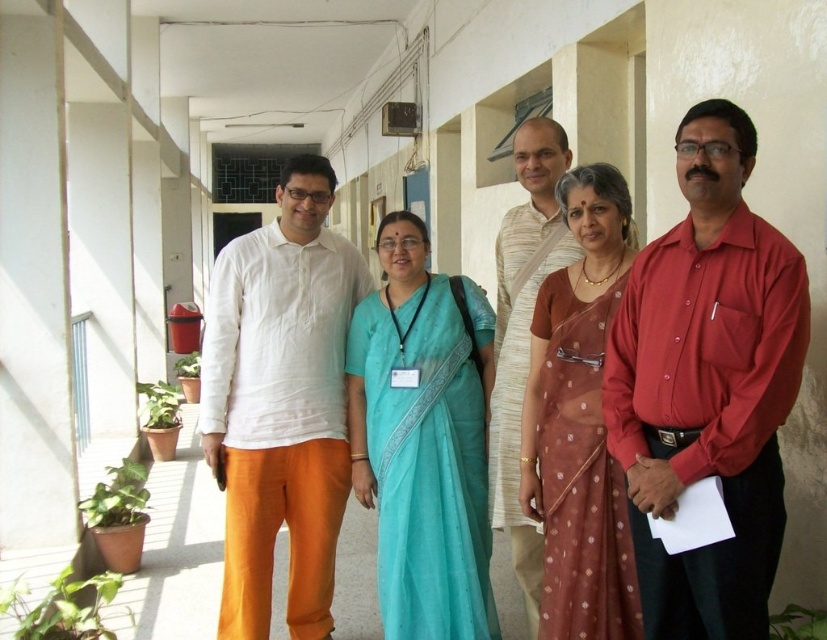
You are standing in the corridor and want to approach the woman in the teal saree with a black blouse and lanyard. The point marked at coordinates (715, 141) is 7.74 feet away from you. Can you estimate how far you need to walk to reach her?

The point marked at coordinates (715, 141) is 7.74 feet away from the viewer, so you need to walk approximately 7.74 feet to reach the woman in the teal saree with a black blouse and lanyard.

You are standing in the corridor and want to greet the person wearing the matte white shirt at center. Which direction should you move relative to the light beige cotton shirt at center?

The matte white shirt at center is to the right of the light beige cotton shirt at center, so you should move to the right side of the light beige cotton shirt at center to greet the person wearing the matte white shirt at center.

You are a photographer standing in the corridor. You want to take a photo of the shiny red shirt at right and the white cotton shirt at center. The camera you are using has a minimum focus distance of 1.5 meters. Can you capture both shirts in focus without moving either of them?

The shiny red shirt at right is 1.69 meters away from the white cotton shirt at center. Since the distance between them is greater than the camera minimum focus distance of 1.5 meters, you can capture both shirts in focus without moving them.